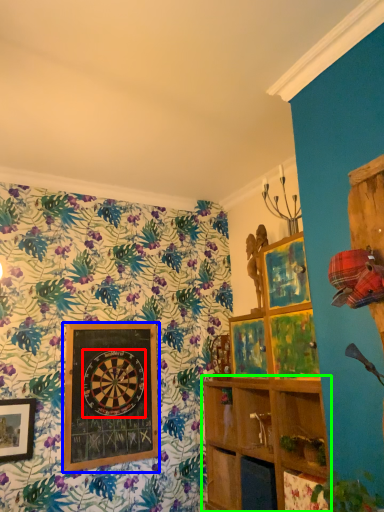
Question: Which object is the farthest from design (highlighted by a red box)? Choose among these: picture frame (highlighted by a blue box) or shelf (highlighted by a green box).

Choices:
 (A) picture frame
 (B) shelf

Answer: (B)